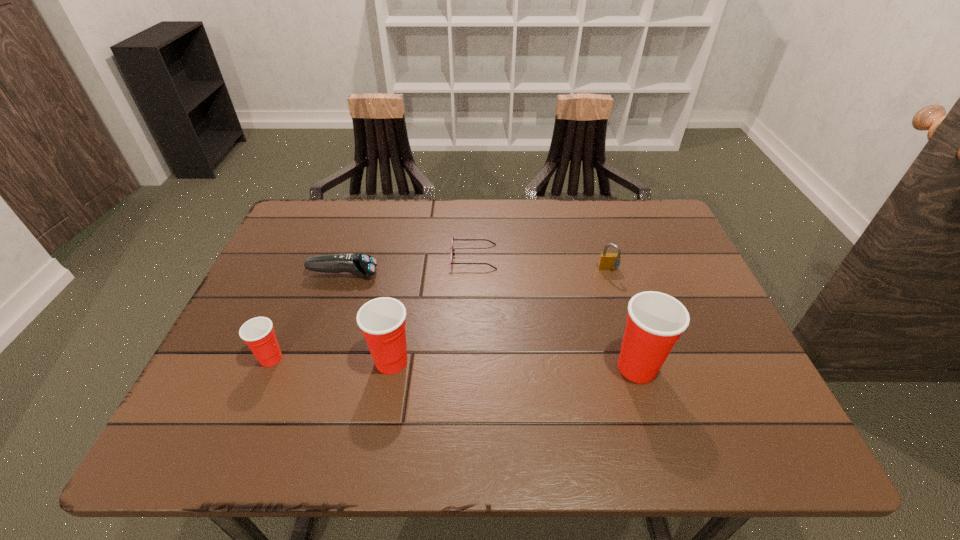
This screenshot has height=540, width=960. I want to click on vacant space at the right edge, so click(x=698, y=321).

Image resolution: width=960 pixels, height=540 pixels. Find the location of `free region at the far left corner`. free region at the far left corner is located at coordinates tap(288, 241).

Where is `free space at the far right corner of the desktop`? free space at the far right corner of the desktop is located at coordinates (638, 240).

The image size is (960, 540). I want to click on free space between the fifth tallest object and the leftmost Dixie cup, so click(307, 316).

Locate an element on the screen. vacant space in between the rightmost Dixie cup and the electric shaver is located at coordinates (490, 321).

Where is `vacant area between the electric shaver and the padlock`? The width and height of the screenshot is (960, 540). vacant area between the electric shaver and the padlock is located at coordinates (476, 272).

This screenshot has width=960, height=540. What are the coordinates of `vacant area between the rightmost Dixie cup and the electric shaver` in the screenshot? It's located at (490, 321).

Locate an element on the screen. free space between the rightmost Dixie cup and the second shortest object is located at coordinates (490, 321).

The width and height of the screenshot is (960, 540). Identify the location of vacant point located between the padlock and the rightmost Dixie cup. (623, 319).

Where is `vacant area that lies between the padlock and the shortest Dixie cup`? The height and width of the screenshot is (540, 960). vacant area that lies between the padlock and the shortest Dixie cup is located at coordinates (440, 314).